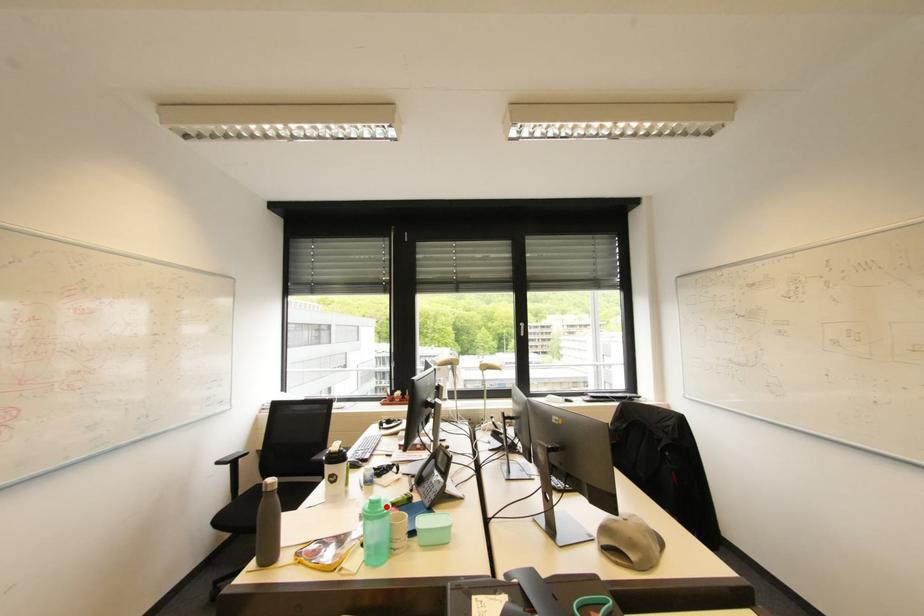
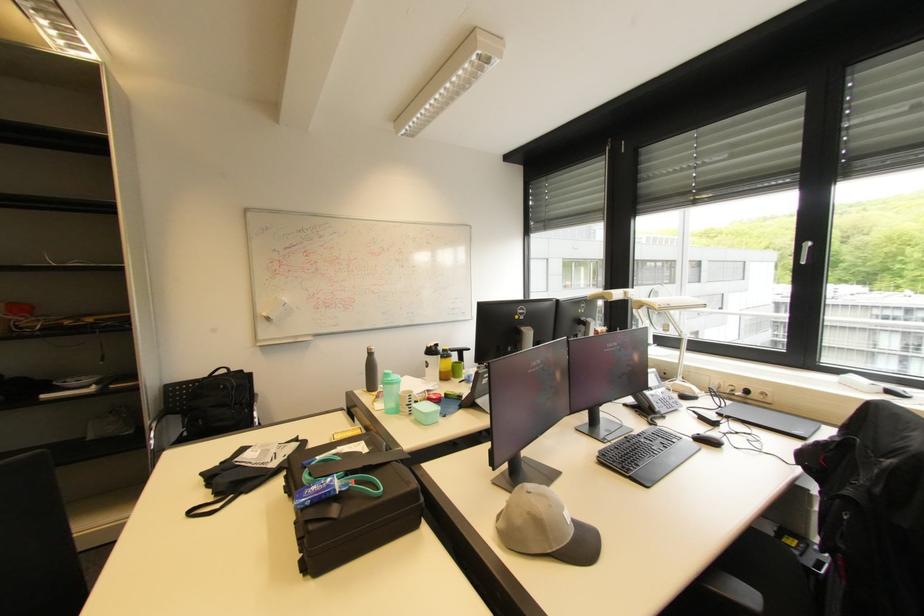
Locate, in the second image, the point that corresponds to the highlighted location in the first image.

(394, 379)